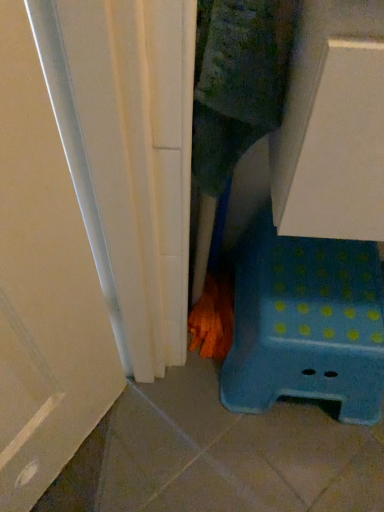
Question: Based on their positions, is orange textured broom at lower center located to the left or right of blue plastic stool at lower right?

Choices:
 (A) right
 (B) left

Answer: (B)

Question: From their relative heights in the image, would you say orange textured broom at lower center is taller or shorter than blue plastic stool at lower right?

Choices:
 (A) short
 (B) tall

Answer: (A)

Question: Looking at the image, does orange textured broom at lower center seem bigger or smaller compared to blue plastic stool at lower right?

Choices:
 (A) small
 (B) big

Answer: (A)

Question: From a real-world perspective, is blue plastic stool at lower right positioned above or below orange textured broom at lower center?

Choices:
 (A) below
 (B) above

Answer: (B)

Question: Is blue plastic stool at lower right to the left or to the right of orange textured broom at lower center in the image?

Choices:
 (A) right
 (B) left

Answer: (A)

Question: Considering their positions, is blue plastic stool at lower right located in front of or behind orange textured broom at lower center?

Choices:
 (A) behind
 (B) front

Answer: (B)

Question: In terms of width, does blue plastic stool at lower right look wider or thinner when compared to orange textured broom at lower center?

Choices:
 (A) thin
 (B) wide

Answer: (B)